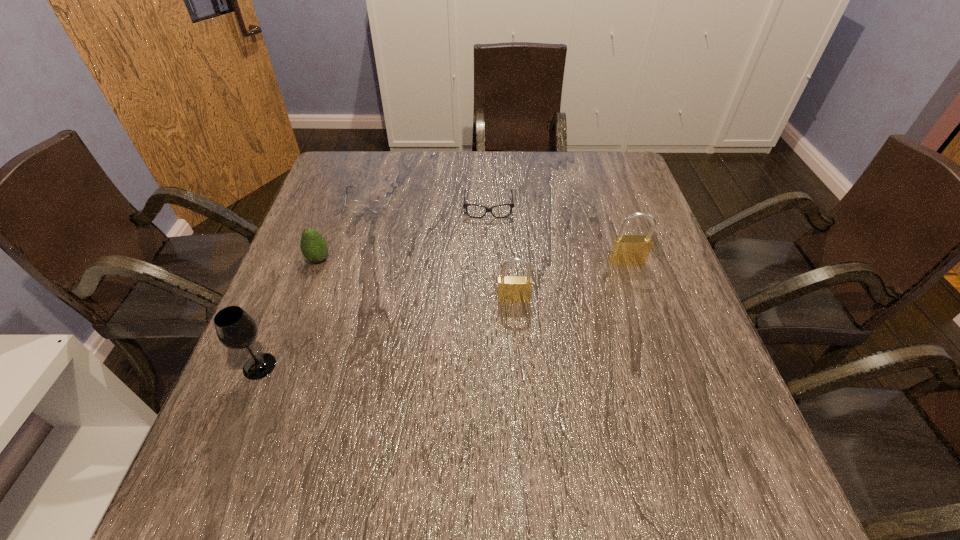
This screenshot has width=960, height=540. Find the location of `the fourth shortest object`. the fourth shortest object is located at coordinates (513, 289).

This screenshot has height=540, width=960. In order to click on the left padlock in this screenshot , I will do pos(513,289).

Locate an element on the screen. the farther padlock is located at coordinates (627, 250).

Identify the location of the right padlock. The height and width of the screenshot is (540, 960). (627, 250).

Locate an element on the screen. Image resolution: width=960 pixels, height=540 pixels. the third shortest object is located at coordinates (314, 247).

Find the location of a particular element. The image size is (960, 540). the right spectacles is located at coordinates pos(512,205).

The width and height of the screenshot is (960, 540). In order to click on wineglass in this screenshot , I will do `click(235, 328)`.

You are a GUI agent. You are given a task and a screenshot of the screen. Output one action in this format:
    pyautogui.click(x=<x>, y=<y>)
    Task: Click on the left spectacles
    
    Given the screenshot: What is the action you would take?
    pyautogui.click(x=355, y=206)

Where is `blank space located on the front-facing side of the fourth shortest object`? Image resolution: width=960 pixels, height=540 pixels. blank space located on the front-facing side of the fourth shortest object is located at coordinates (520, 387).

In order to click on vacant space located on the front-facing side of the rightmost object in this screenshot , I will do `click(673, 402)`.